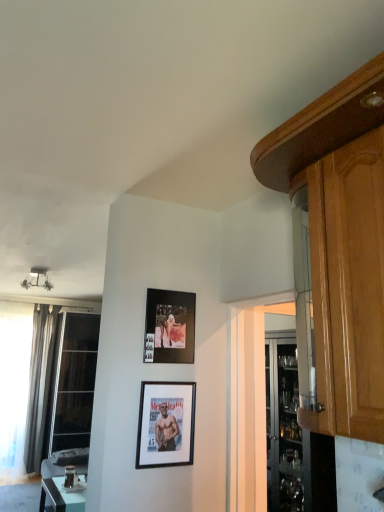
I want to click on white sheer curtain at left, placed as the 2th window when sorted from right to left, so click(14, 385).

Describe the element at coordinates (14, 385) in the screenshot. The width and height of the screenshot is (384, 512). I see `white sheer curtain at left, marked as the first window in a left-to-right arrangement` at that location.

What do you see at coordinates (340, 242) in the screenshot?
I see `glossy wood cabinet at upper right` at bounding box center [340, 242].

The height and width of the screenshot is (512, 384). Describe the element at coordinates (169, 327) in the screenshot. I see `matte black photo frame at upper center, positioned as the 2th picture frame in bottom-to-top order` at that location.

Where is `matte black photo frame at upper center, positioned as the 2th picture frame in bottom-to-top order`? This screenshot has height=512, width=384. matte black photo frame at upper center, positioned as the 2th picture frame in bottom-to-top order is located at coordinates [x=169, y=327].

I want to click on silky gray curtain at left, so click(x=39, y=382).

Considering the sizes of objects matte black photo frame at upper center, the 1th picture frame from the top, and glossy wood cabinet at upper right in the image provided, who is thinner, matte black photo frame at upper center, the 1th picture frame from the top, or glossy wood cabinet at upper right?

matte black photo frame at upper center, the 1th picture frame from the top, is thinner.

Is the depth of matte black photo frame at upper center, the 1th picture frame from the top, less than that of glossy wood cabinet at upper right?

No, the depth of matte black photo frame at upper center, the 1th picture frame from the top, is greater than that of glossy wood cabinet at upper right.

How far apart are matte black photo frame at upper center, positioned as the 2th picture frame in bottom-to-top order, and glossy wood cabinet at upper right?

They are 3.84 feet apart.

Considering the relative positions of matte black photo frame at upper center, the 1th picture frame from the top, and glossy wood cabinet at upper right in the image provided, is matte black photo frame at upper center, the 1th picture frame from the top, to the left or to the right of glossy wood cabinet at upper right?

Clearly, matte black photo frame at upper center, the 1th picture frame from the top, is on the left of glossy wood cabinet at upper right in the image.

Is white glossy table at lower left bigger or smaller than black matte picture frame at center, positioned as the second picture frame in top-to-bottom order?

white glossy table at lower left is bigger than black matte picture frame at center, positioned as the second picture frame in top-to-bottom order.

What's the angular difference between white glossy table at lower left and black matte picture frame at center, positioned as the second picture frame in top-to-bottom order,'s facing directions?

There is a 91.6-degree angle between the facing directions of white glossy table at lower left and black matte picture frame at center, positioned as the second picture frame in top-to-bottom order.

Is white glossy table at lower left further to the viewer compared to black matte picture frame at center, positioned as the second picture frame in top-to-bottom order?

Yes, the depth of white glossy table at lower left is greater than that of black matte picture frame at center, positioned as the second picture frame in top-to-bottom order.

From the image's perspective, who appears lower, silky gray curtain at left or glossy wood cabinet at upper right?

silky gray curtain at left, from the image's perspective.

In the scene shown: From a real-world perspective, which is physically above, silky gray curtain at left or glossy wood cabinet at upper right?

glossy wood cabinet at upper right, from a real-world perspective.

Are silky gray curtain at left and glossy wood cabinet at upper right located far from each other?

Yes, silky gray curtain at left is far from glossy wood cabinet at upper right.

Relative to glossy wood cabinet at upper right, is silky gray curtain at left in front or behind?

Clearly, silky gray curtain at left is behind glossy wood cabinet at upper right.

From the image's perspective, is white glossy table at lower left below silky gray curtain at left?

Yes, from the image's perspective, white glossy table at lower left is beneath silky gray curtain at left.

From the picture: Relative to silky gray curtain at left, is white glossy table at lower left in front or behind?

white glossy table at lower left is in front of silky gray curtain at left.

Is white glossy table at lower left to the left or to the right of silky gray curtain at left in the image?

Based on their positions, white glossy table at lower left is located to the right of silky gray curtain at left.

Between black matte picture frame at center, which ranks as the 1th picture frame in bottom-to-top order, and glossy wood cabinet at upper right, which one has less height?

black matte picture frame at center, which ranks as the 1th picture frame in bottom-to-top order, is shorter.

Is point (184, 404) in front of point (370, 365)?

No, (184, 404) is behind (370, 365).

How different are the orientations of black matte picture frame at center, which ranks as the 1th picture frame in bottom-to-top order, and glossy wood cabinet at upper right in degrees?

The facing directions of black matte picture frame at center, which ranks as the 1th picture frame in bottom-to-top order, and glossy wood cabinet at upper right are 90 degrees apart.

I want to click on cabinetry on the right of black matte picture frame at center, positioned as the second picture frame in top-to-bottom order, so click(340, 242).

From a real-world perspective, which is physically below, glossy wood cabinet at upper right or black matte picture frame at center, which ranks as the 1th picture frame in bottom-to-top order?

In real-world perspective, black matte picture frame at center, which ranks as the 1th picture frame in bottom-to-top order, is lower.

Considering the sizes of glossy wood cabinet at upper right and black matte picture frame at center, which ranks as the 1th picture frame in bottom-to-top order, in the image, is glossy wood cabinet at upper right bigger or smaller than black matte picture frame at center, which ranks as the 1th picture frame in bottom-to-top order,?

glossy wood cabinet at upper right is bigger than black matte picture frame at center, which ranks as the 1th picture frame in bottom-to-top order.

Considering the sizes of glossy wood cabinet at upper right and black matte picture frame at center, which ranks as the 1th picture frame in bottom-to-top order, in the image, is glossy wood cabinet at upper right taller or shorter than black matte picture frame at center, which ranks as the 1th picture frame in bottom-to-top order,?

Clearly, glossy wood cabinet at upper right is taller compared to black matte picture frame at center, which ranks as the 1th picture frame in bottom-to-top order.

Where is `picture frame that is the 2nd object directly below the glossy wood cabinet at upper right (from a real-world perspective)`? The image size is (384, 512). picture frame that is the 2nd object directly below the glossy wood cabinet at upper right (from a real-world perspective) is located at coordinates 166,424.

How many degrees apart are the facing directions of black matte picture frame at center, positioned as the second picture frame in top-to-bottom order, and white sheer curtain at left, marked as the first window in a left-to-right arrangement?

The angle between the facing direction of black matte picture frame at center, positioned as the second picture frame in top-to-bottom order, and the facing direction of white sheer curtain at left, marked as the first window in a left-to-right arrangement, is 2.55 degrees.

From a real-world perspective, is black matte picture frame at center, which ranks as the 1th picture frame in bottom-to-top order, below white sheer curtain at left, marked as the first window in a left-to-right arrangement?

No, from a real-world perspective, black matte picture frame at center, which ranks as the 1th picture frame in bottom-to-top order, is not below white sheer curtain at left, marked as the first window in a left-to-right arrangement.

Is white sheer curtain at left, marked as the first window in a left-to-right arrangement, inside black matte picture frame at center, which ranks as the 1th picture frame in bottom-to-top order?

That's incorrect, white sheer curtain at left, marked as the first window in a left-to-right arrangement, is not inside black matte picture frame at center, which ranks as the 1th picture frame in bottom-to-top order.

Is black matte picture frame at center, positioned as the second picture frame in top-to-bottom order, taller than white sheer curtain at left, marked as the first window in a left-to-right arrangement?

Incorrect, the height of black matte picture frame at center, positioned as the second picture frame in top-to-bottom order, is not larger of that of white sheer curtain at left, marked as the first window in a left-to-right arrangement.

The height and width of the screenshot is (512, 384). Find the location of `cabinetry positioned vertically above the matte black photo frame at upper center, positioned as the 2th picture frame in bottom-to-top order (from a real-world perspective)`. cabinetry positioned vertically above the matte black photo frame at upper center, positioned as the 2th picture frame in bottom-to-top order (from a real-world perspective) is located at coordinates (340, 242).

At what (x,y) coordinates should I click in order to perform the action: click on table below the black matte picture frame at center, positioned as the second picture frame in top-to-bottom order (from the image's perspective). Please return your answer as a coordinate pair (x, y). Image resolution: width=384 pixels, height=512 pixels. Looking at the image, I should click on (60, 497).

Looking at the image, which one is located further to white glossy table at lower left, glossy wood cabinet at upper right or silky gray curtain at left?

glossy wood cabinet at upper right.

Looking at the image, which one is located closer to white glossy table at lower left, black matte picture frame at center, which ranks as the 1th picture frame in bottom-to-top order, or silky gray curtain at left?

Based on the image, silky gray curtain at left appears to be nearer to white glossy table at lower left.

Looking at the image, which one is located further to black matte picture frame at center, positioned as the second picture frame in top-to-bottom order, transparent glass window at left, which ranks as the 2th window in left-to-right order, or silky gray curtain at left?

The object further to black matte picture frame at center, positioned as the second picture frame in top-to-bottom order, is silky gray curtain at left.

Based on their spatial positions, is matte black photo frame at upper center, the 1th picture frame from the top, or black matte picture frame at center, positioned as the second picture frame in top-to-bottom order, further from silky gray curtain at left?

Among the two, matte black photo frame at upper center, the 1th picture frame from the top, is located further to silky gray curtain at left.

Looking at the image, which one is located further to transparent glass window at left, the 1th window from the right, white sheer curtain at left, placed as the 2th window when sorted from right to left, or black matte picture frame at center, which ranks as the 1th picture frame in bottom-to-top order?

The object further to transparent glass window at left, the 1th window from the right, is black matte picture frame at center, which ranks as the 1th picture frame in bottom-to-top order.

Based on their spatial positions, is white glossy table at lower left or silky gray curtain at left closer to black matte picture frame at center, which ranks as the 1th picture frame in bottom-to-top order?

white glossy table at lower left is positioned closer to the anchor black matte picture frame at center, which ranks as the 1th picture frame in bottom-to-top order.

Considering their positions, is white glossy table at lower left positioned further to matte black photo frame at upper center, the 1th picture frame from the top, than white sheer curtain at left, marked as the first window in a left-to-right arrangement?

white sheer curtain at left, marked as the first window in a left-to-right arrangement, is positioned further to the anchor matte black photo frame at upper center, the 1th picture frame from the top.

Consider the image. Estimate the real-world distances between objects in this image. Which object is further from glossy wood cabinet at upper right, black matte picture frame at center, positioned as the second picture frame in top-to-bottom order, or white glossy table at lower left?

Among the two, white glossy table at lower left is located further to glossy wood cabinet at upper right.

What are the coordinates of `table located between matte black photo frame at upper center, positioned as the 2th picture frame in bottom-to-top order, and silky gray curtain at left in the depth direction` in the screenshot? It's located at (60, 497).

Where is `window located between matte black photo frame at upper center, the 1th picture frame from the top, and white sheer curtain at left, marked as the first window in a left-to-right arrangement, in the depth direction`? Image resolution: width=384 pixels, height=512 pixels. window located between matte black photo frame at upper center, the 1th picture frame from the top, and white sheer curtain at left, marked as the first window in a left-to-right arrangement, in the depth direction is located at coordinates (71, 392).

Locate an element on the screen. The image size is (384, 512). picture frame between matte black photo frame at upper center, the 1th picture frame from the top, and white glossy table at lower left, in the vertical direction is located at coordinates (166, 424).

Find the location of `curtain between white sheer curtain at left, placed as the 2th window when sorted from right to left, and transparent glass window at left, which ranks as the 2th window in left-to-right order, from left to right`. curtain between white sheer curtain at left, placed as the 2th window when sorted from right to left, and transparent glass window at left, which ranks as the 2th window in left-to-right order, from left to right is located at coordinates click(39, 382).